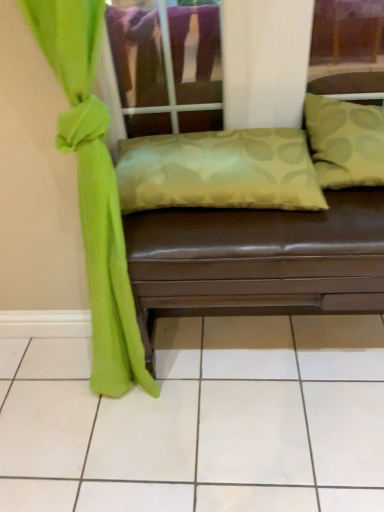
Question: Is green fabric pillow at upper right, which ranks as the 1th pillow in right-to-left order, at the left side of satin green pillow at center, placed as the 2th pillow when sorted from right to left?

Choices:
 (A) yes
 (B) no

Answer: (B)

Question: Is green fabric pillow at upper right, which ranks as the 1th pillow in right-to-left order, behind satin green pillow at center, placed as the 2th pillow when sorted from right to left?

Choices:
 (A) yes
 (B) no

Answer: (B)

Question: Is green fabric pillow at upper right, which is the second pillow in left-to-right order, completely or partially outside of satin green pillow at center, placed as the 1th pillow when sorted from left to right?

Choices:
 (A) yes
 (B) no

Answer: (A)

Question: Is green fabric pillow at upper right, which ranks as the 1th pillow in right-to-left order, positioned with its back to satin green pillow at center, placed as the 1th pillow when sorted from left to right?

Choices:
 (A) no
 (B) yes

Answer: (A)

Question: Is green fabric pillow at upper right, which ranks as the 1th pillow in right-to-left order, thinner than satin green pillow at center, placed as the 2th pillow when sorted from right to left?

Choices:
 (A) no
 (B) yes

Answer: (A)

Question: In the image, is green fabric pillow at upper right, which is the second pillow in left-to-right order, positioned in front of or behind satin green pillow at center, placed as the 1th pillow when sorted from left to right?

Choices:
 (A) front
 (B) behind

Answer: (A)

Question: Does point (329, 128) appear closer or farther from the camera than point (172, 137)?

Choices:
 (A) farther
 (B) closer

Answer: (B)

Question: Is green fabric pillow at upper right, which is the second pillow in left-to-right order, inside or outside of satin green pillow at center, placed as the 1th pillow when sorted from left to right?

Choices:
 (A) inside
 (B) outside

Answer: (B)

Question: From a real-world perspective, is green fabric pillow at upper right, which is the second pillow in left-to-right order, physically located above or below satin green pillow at center, placed as the 2th pillow when sorted from right to left?

Choices:
 (A) below
 (B) above

Answer: (B)

Question: Is green fabric curtain at left to the left or to the right of green fabric pillow at upper right, which is the second pillow in left-to-right order, in the image?

Choices:
 (A) right
 (B) left

Answer: (B)

Question: Is green fabric curtain at left bigger or smaller than green fabric pillow at upper right, which is the second pillow in left-to-right order?

Choices:
 (A) big
 (B) small

Answer: (A)

Question: From their relative heights in the image, would you say green fabric curtain at left is taller or shorter than green fabric pillow at upper right, which ranks as the 1th pillow in right-to-left order?

Choices:
 (A) short
 (B) tall

Answer: (B)

Question: Is green fabric curtain at left inside the boundaries of green fabric pillow at upper right, which ranks as the 1th pillow in right-to-left order, or outside?

Choices:
 (A) inside
 (B) outside

Answer: (B)

Question: Considering the positions of point (198, 167) and point (347, 140), is point (198, 167) closer or farther from the camera than point (347, 140)?

Choices:
 (A) farther
 (B) closer

Answer: (B)

Question: In terms of height, does satin green pillow at center, placed as the 2th pillow when sorted from right to left, look taller or shorter compared to green fabric pillow at upper right, which is the second pillow in left-to-right order?

Choices:
 (A) tall
 (B) short

Answer: (B)